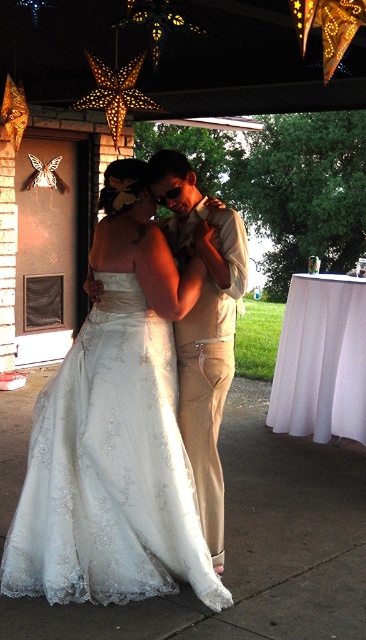
Looking at the couple dancing in their formal attire, which piece of clothing is shorter between the white satin dress at center and the tan fabric pants at center?

The white satin dress at center is shorter than the tan fabric pants at center according to the description.

You are a photographer at a wedding reception and need to capture a shot of the couple dancing. The white satin dress at center and the tan fabric pants at center are currently positioned in a way that might block the view of the brick wall behind them. Which direction should you move the couple so that the dress is no longer blocking the wall?

Move the couple to the right so that the white satin dress at center is no longer blocking the brick wall since the white satin dress at center is to the left of the tan fabric pants at center.